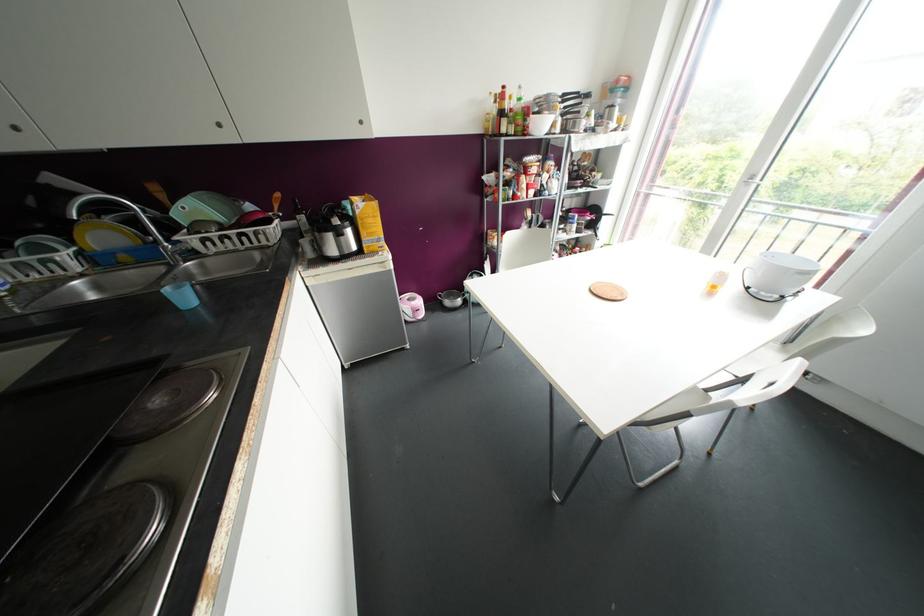
The location [180,294] corresponds to which object?

It refers to a blue plastic cup.